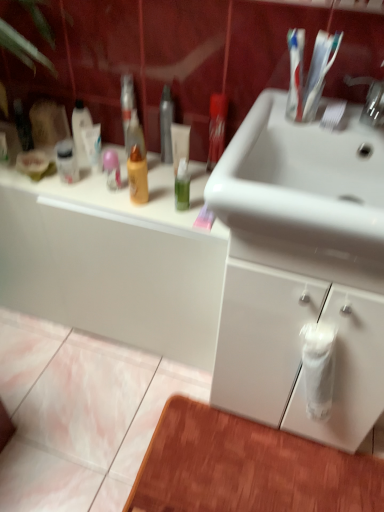
How much space does white glossy cabinet at lower left, which is counted as the second bathroom cabinet, starting from the right, occupy vertically?

25.16 inches.

What is the approximate width of white glossy cabinet at lower right, arranged as the second bathroom cabinet when viewed from the left?

white glossy cabinet at lower right, arranged as the second bathroom cabinet when viewed from the left, is 18.09 inches in width.

The height and width of the screenshot is (512, 384). I want to click on white glossy sink at upper center, so click(x=304, y=195).

Locate an element on the screen. white glossy cabinet at lower left, arranged as the 1th bathroom cabinet when viewed from the left is located at coordinates (114, 260).

Is white glossy cabinet at lower left, which is counted as the second bathroom cabinet, starting from the right, facing towards white glossy cabinet at lower right, placed as the 1th bathroom cabinet when sorted from right to left?

No, white glossy cabinet at lower left, which is counted as the second bathroom cabinet, starting from the right, is not aimed at white glossy cabinet at lower right, placed as the 1th bathroom cabinet when sorted from right to left.

From the picture: Considering the sizes of objects white glossy cabinet at lower left, arranged as the 1th bathroom cabinet when viewed from the left, and white glossy cabinet at lower right, arranged as the second bathroom cabinet when viewed from the left, in the image provided, who is smaller, white glossy cabinet at lower left, arranged as the 1th bathroom cabinet when viewed from the left, or white glossy cabinet at lower right, arranged as the second bathroom cabinet when viewed from the left,?

white glossy cabinet at lower right, arranged as the second bathroom cabinet when viewed from the left, is smaller.

Is white glossy cabinet at lower left, which is counted as the second bathroom cabinet, starting from the right, thinner than white glossy cabinet at lower right, arranged as the second bathroom cabinet when viewed from the left?

Correct, the width of white glossy cabinet at lower left, which is counted as the second bathroom cabinet, starting from the right, is less than that of white glossy cabinet at lower right, arranged as the second bathroom cabinet when viewed from the left.

Would you say white glossy cabinet at lower right, arranged as the second bathroom cabinet when viewed from the left, is part of white glossy cabinet at lower left, arranged as the 1th bathroom cabinet when viewed from the left,'s contents?

No, white glossy cabinet at lower left, arranged as the 1th bathroom cabinet when viewed from the left, does not contain white glossy cabinet at lower right, arranged as the second bathroom cabinet when viewed from the left.

Is white glossy sink at upper center facing away from white glossy cabinet at lower left, which is counted as the second bathroom cabinet, starting from the right?

No, white glossy sink at upper center is not facing the opposite direction of white glossy cabinet at lower left, which is counted as the second bathroom cabinet, starting from the right.

How different are the orientations of white glossy sink at upper center and white glossy cabinet at lower left, arranged as the 1th bathroom cabinet when viewed from the left, in degrees?

The angle between the facing direction of white glossy sink at upper center and the facing direction of white glossy cabinet at lower left, arranged as the 1th bathroom cabinet when viewed from the left, is 1.31 degrees.

Does point (223, 196) appear closer or farther from the camera than point (114, 281)?

Clearly, point (223, 196) is closer to the camera than point (114, 281).

Looking at this image, considering the positions of objects white glossy sink at upper center and white glossy cabinet at lower left, which is counted as the second bathroom cabinet, starting from the right, in the image provided, who is in front, white glossy sink at upper center or white glossy cabinet at lower left, which is counted as the second bathroom cabinet, starting from the right,?

white glossy sink at upper center is closer to the camera.

From a real-world perspective, does white glossy cabinet at lower right, arranged as the second bathroom cabinet when viewed from the left, sit lower than white glossy sink at upper center?

Yes.

Is white glossy cabinet at lower right, arranged as the second bathroom cabinet when viewed from the left, to the left of white glossy sink at upper center from the viewer's perspective?

No, white glossy cabinet at lower right, arranged as the second bathroom cabinet when viewed from the left, is not to the left of white glossy sink at upper center.

Find the location of a particular element. the 1st bathroom cabinet behind the white glossy sink at upper center is located at coordinates (298, 343).

Does white glossy cabinet at lower right, arranged as the second bathroom cabinet when viewed from the left, come behind white glossy cabinet at lower left, which is counted as the second bathroom cabinet, starting from the right?

No.

Is white glossy cabinet at lower right, arranged as the second bathroom cabinet when viewed from the left, to the left of white glossy cabinet at lower left, arranged as the 1th bathroom cabinet when viewed from the left, from the viewer's perspective?

No, white glossy cabinet at lower right, arranged as the second bathroom cabinet when viewed from the left, is not to the left of white glossy cabinet at lower left, arranged as the 1th bathroom cabinet when viewed from the left.

Is white glossy cabinet at lower left, which is counted as the second bathroom cabinet, starting from the right, surrounded by white glossy cabinet at lower right, arranged as the second bathroom cabinet when viewed from the left?

That's incorrect, white glossy cabinet at lower left, which is counted as the second bathroom cabinet, starting from the right, is not inside white glossy cabinet at lower right, arranged as the second bathroom cabinet when viewed from the left.

How different are the orientations of white glossy cabinet at lower right, arranged as the second bathroom cabinet when viewed from the left, and white glossy cabinet at lower left, which is counted as the second bathroom cabinet, starting from the right, in degrees?

white glossy cabinet at lower right, arranged as the second bathroom cabinet when viewed from the left, and white glossy cabinet at lower left, which is counted as the second bathroom cabinet, starting from the right, are facing 0.341 degrees away from each other.

From the image's perspective, between white glossy sink at upper center and white glossy cabinet at lower right, arranged as the second bathroom cabinet when viewed from the left, which one is located above?

white glossy sink at upper center is shown above in the image.

Is point (338, 132) closer to camera compared to point (278, 273)?

No, (338, 132) is further to viewer.

Considering the relative sizes of white glossy sink at upper center and white glossy cabinet at lower right, placed as the 1th bathroom cabinet when sorted from right to left, in the image provided, is white glossy sink at upper center thinner than white glossy cabinet at lower right, placed as the 1th bathroom cabinet when sorted from right to left,?

In fact, white glossy sink at upper center might be wider than white glossy cabinet at lower right, placed as the 1th bathroom cabinet when sorted from right to left.

How different are the orientations of white glossy sink at upper center and white glossy cabinet at lower right, arranged as the second bathroom cabinet when viewed from the left, in degrees?

They differ by 0.972 degrees in their facing directions.

Is white glossy cabinet at lower left, arranged as the 1th bathroom cabinet when viewed from the left, in contact with white glossy sink at upper center?

No, white glossy cabinet at lower left, arranged as the 1th bathroom cabinet when viewed from the left, is not beside white glossy sink at upper center.

From the image's perspective, which one is positioned lower, white glossy cabinet at lower left, arranged as the 1th bathroom cabinet when viewed from the left, or white glossy sink at upper center?

white glossy cabinet at lower left, arranged as the 1th bathroom cabinet when viewed from the left, from the image's perspective.

Does point (145, 340) come behind point (349, 251)?

Yes, it is behind point (349, 251).

Which object is wider, white glossy cabinet at lower left, which is counted as the second bathroom cabinet, starting from the right, or white glossy sink at upper center?

With larger width is white glossy sink at upper center.

The image size is (384, 512). Identify the location of bathroom cabinet that is above the white glossy cabinet at lower left, arranged as the 1th bathroom cabinet when viewed from the left (from a real-world perspective). (298, 343).

Identify the location of sink on the right of the white glossy cabinet at lower left, which is counted as the second bathroom cabinet, starting from the right. (304, 195).

Which object lies further to the anchor point white glossy cabinet at lower left, arranged as the 1th bathroom cabinet when viewed from the left, white glossy sink at upper center or white glossy cabinet at lower right, arranged as the second bathroom cabinet when viewed from the left?

Based on the image, white glossy sink at upper center appears to be further to white glossy cabinet at lower left, arranged as the 1th bathroom cabinet when viewed from the left.

Estimate the real-world distances between objects in this image. Which object is further from white glossy cabinet at lower right, placed as the 1th bathroom cabinet when sorted from right to left, white glossy cabinet at lower left, which is counted as the second bathroom cabinet, starting from the right, or white glossy sink at upper center?

white glossy cabinet at lower left, which is counted as the second bathroom cabinet, starting from the right, lies further to white glossy cabinet at lower right, placed as the 1th bathroom cabinet when sorted from right to left, than the other object.

Based on their spatial positions, is white glossy cabinet at lower right, placed as the 1th bathroom cabinet when sorted from right to left, or white glossy cabinet at lower left, arranged as the 1th bathroom cabinet when viewed from the left, closer to white glossy sink at upper center?

white glossy cabinet at lower right, placed as the 1th bathroom cabinet when sorted from right to left.

Estimate the real-world distances between objects in this image. Which object is further from white glossy sink at upper center, white glossy cabinet at lower left, arranged as the 1th bathroom cabinet when viewed from the left, or white glossy cabinet at lower right, arranged as the second bathroom cabinet when viewed from the left?

The object further to white glossy sink at upper center is white glossy cabinet at lower left, arranged as the 1th bathroom cabinet when viewed from the left.

Estimate the real-world distances between objects in this image. Which object is closer to white glossy cabinet at lower right, arranged as the second bathroom cabinet when viewed from the left, white glossy sink at upper center or white glossy cabinet at lower left, arranged as the 1th bathroom cabinet when viewed from the left?

white glossy sink at upper center.

Based on the photo, looking at the image, which one is located further to white glossy cabinet at lower left, which is counted as the second bathroom cabinet, starting from the right, white glossy cabinet at lower right, arranged as the second bathroom cabinet when viewed from the left, or white glossy sink at upper center?

white glossy sink at upper center lies further to white glossy cabinet at lower left, which is counted as the second bathroom cabinet, starting from the right, than the other object.

The width and height of the screenshot is (384, 512). I want to click on sink situated between white glossy cabinet at lower left, which is counted as the second bathroom cabinet, starting from the right, and white glossy cabinet at lower right, arranged as the second bathroom cabinet when viewed from the left, from left to right, so click(304, 195).